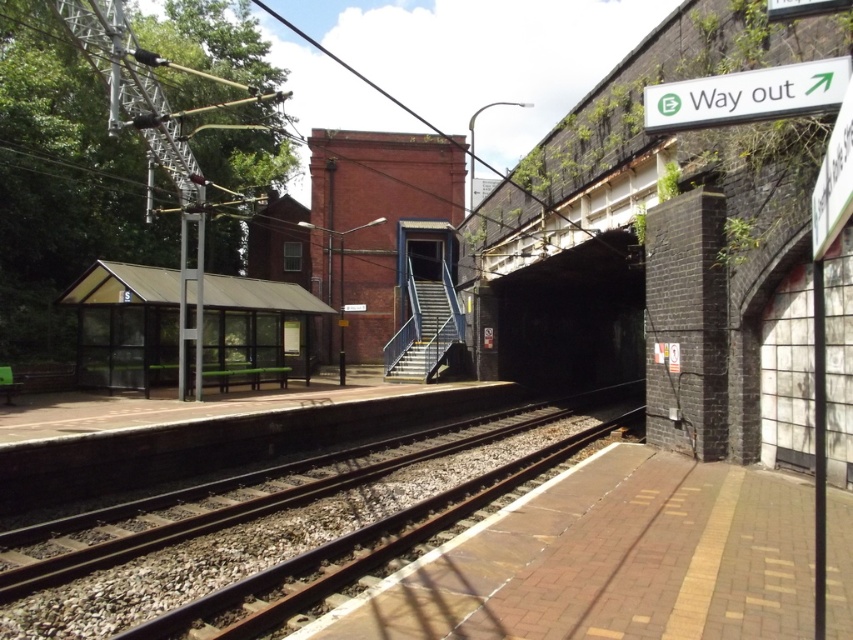
Can you confirm if brown metal train track at center is positioned to the left of transparent plastic bus stop at left?

Incorrect, brown metal train track at center is not on the left side of transparent plastic bus stop at left.

Where is `brown metal train track at center`? This screenshot has height=640, width=853. brown metal train track at center is located at coordinates (267, 524).

The image size is (853, 640). Find the location of `brown metal train track at center`. brown metal train track at center is located at coordinates (267, 524).

Image resolution: width=853 pixels, height=640 pixels. What are the coordinates of `brown metal train track at center` in the screenshot? It's located at (267, 524).